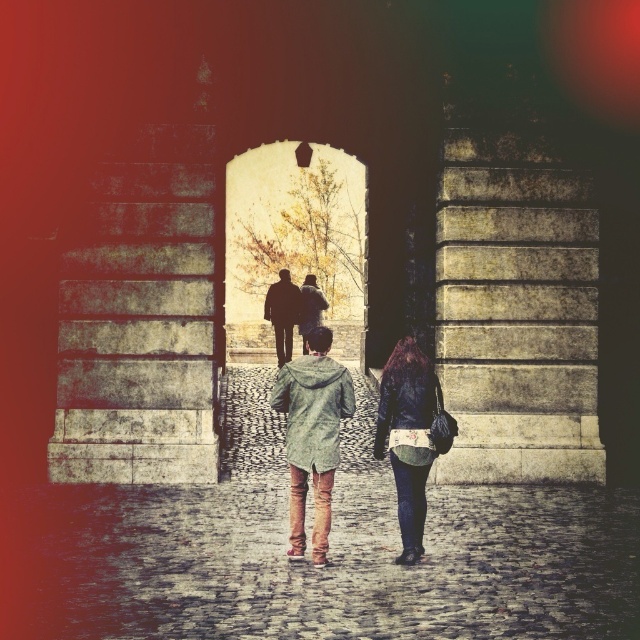
Question: Based on their relative distances, which object is farther from the leather jacket at center?

Choices:
 (A) silhouette leather jacket at center
 (B) green textured coat at center

Answer: (A)

Question: Which of the following is the closest to the observer?

Choices:
 (A) (310, 305)
 (B) (403, 337)
 (C) (316, 428)

Answer: (C)

Question: Is the position of leather jacket at center less distant than that of silhouette leather jacket at center?

Choices:
 (A) no
 (B) yes

Answer: (B)

Question: Which is farther from the leather jacket at center?

Choices:
 (A) green textured coat at center
 (B) silhouette leather jacket at center

Answer: (B)

Question: Is green textured coat at center above silhouette leather jacket at center?

Choices:
 (A) yes
 (B) no

Answer: (B)

Question: Does green textured coat at center appear under silhouette leather jacket at center?

Choices:
 (A) no
 (B) yes

Answer: (B)